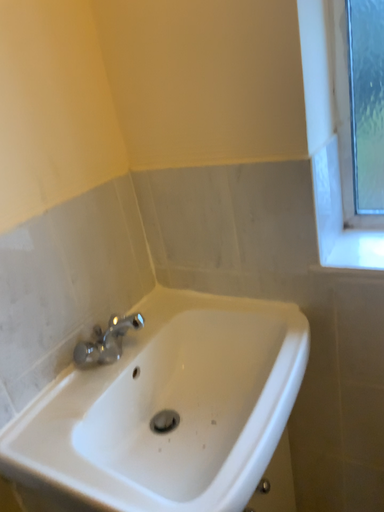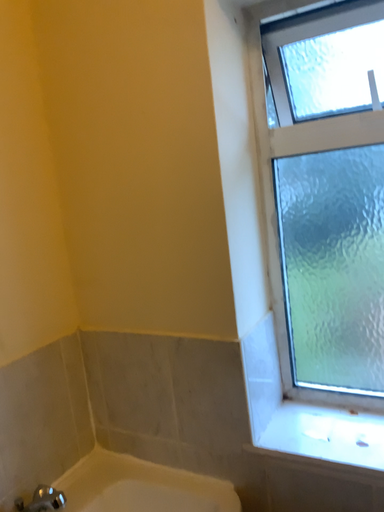
Question: Which way did the camera rotate in the video?

Choices:
 (A) rotated downward
 (B) rotated upward

Answer: (B)